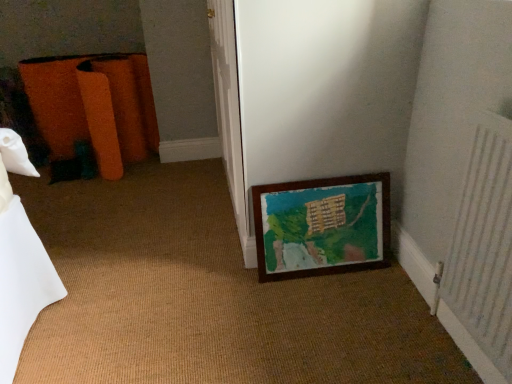
Question: Looking at the image, does wooden frame at lower right seem bigger or smaller compared to white textured radiator at right?

Choices:
 (A) big
 (B) small

Answer: (B)

Question: From the image's perspective, is wooden frame at lower right positioned above or below white textured radiator at right?

Choices:
 (A) above
 (B) below

Answer: (A)

Question: Which object is the closest to the wooden frame at lower right?

Choices:
 (A) orange fabric bag at left
 (B) white textured radiator at right

Answer: (B)

Question: Which of these objects is positioned closest to the white textured radiator at right?

Choices:
 (A) wooden frame at lower right
 (B) orange fabric bag at left

Answer: (A)